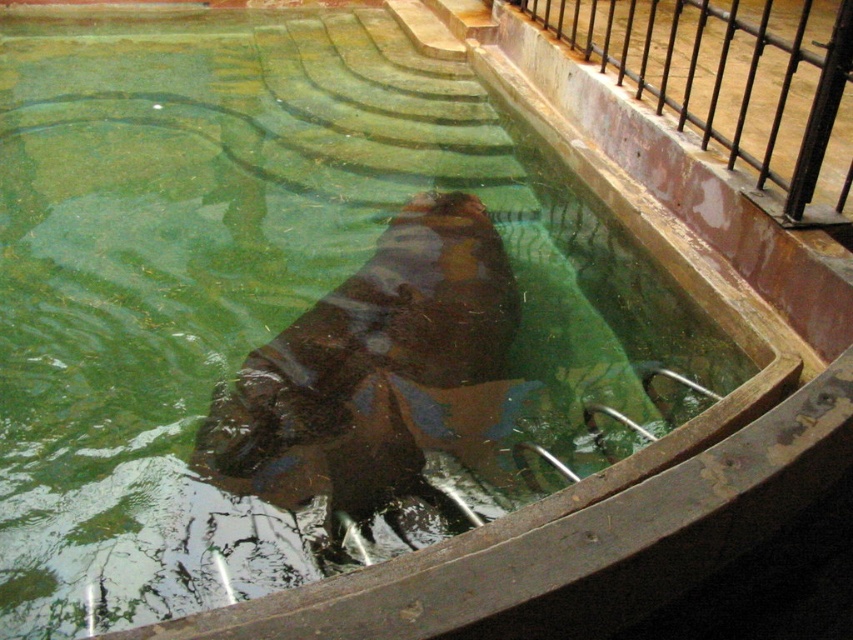
Question: In this image, where is brown matte hippo at center located relative to black metal rail at upper right?

Choices:
 (A) right
 (B) left

Answer: (B)

Question: Which of the following is the farthest from the observer?

Choices:
 (A) (227, 470)
 (B) (750, 76)

Answer: (B)

Question: Does brown matte hippo at center have a larger size compared to black metal rail at upper right?

Choices:
 (A) no
 (B) yes

Answer: (A)

Question: Which of the following is the closest to the observer?

Choices:
 (A) (817, 100)
 (B) (384, 355)

Answer: (A)

Question: Can you confirm if brown matte hippo at center is positioned to the left of black metal rail at upper right?

Choices:
 (A) yes
 (B) no

Answer: (A)